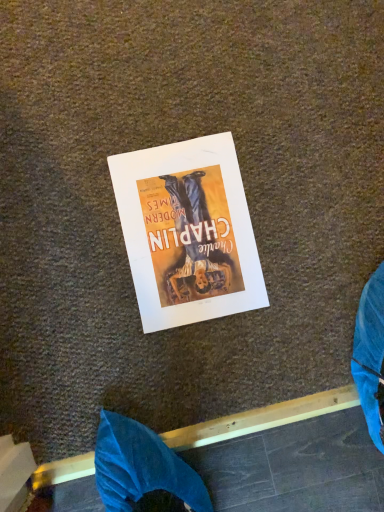
The height and width of the screenshot is (512, 384). I want to click on matte paper poster at center, so tap(188, 232).

Image resolution: width=384 pixels, height=512 pixels. What do you see at coordinates (188, 232) in the screenshot?
I see `matte paper poster at center` at bounding box center [188, 232].

Measure the distance between point (172, 319) and camera.

The depth of point (172, 319) is 27.09 inches.

I want to click on matte paper poster at center, so click(x=188, y=232).